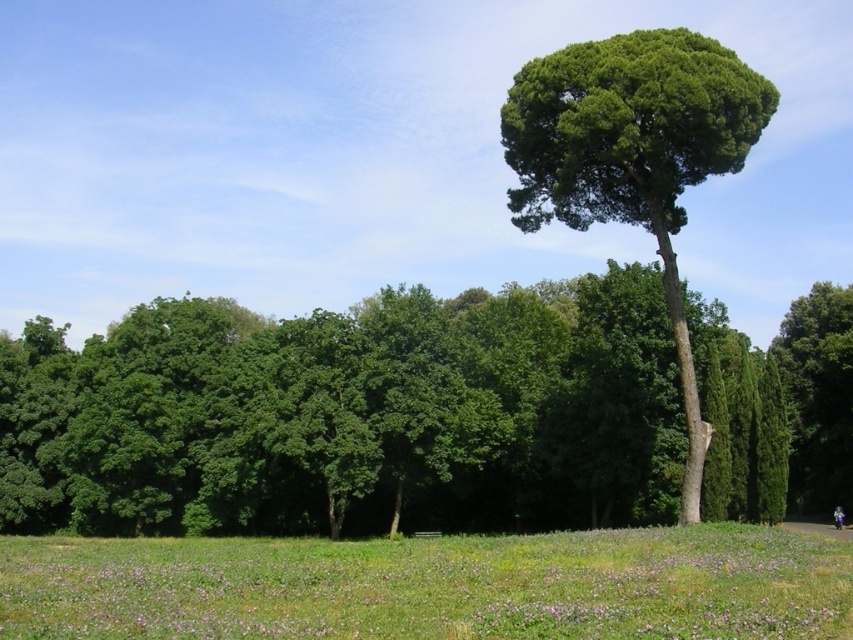
Based on the photo, is green leafy tree at right behind dark blue jeans at center?

Yes.

From the picture: Can you confirm if green leafy tree at right is positioned to the right of dark blue jeans at center?

Yes, green leafy tree at right is to the right of dark blue jeans at center.

Locate an element on the screen. Image resolution: width=853 pixels, height=640 pixels. green leafy tree at right is located at coordinates (817, 396).

This screenshot has height=640, width=853. Describe the element at coordinates (433, 586) in the screenshot. I see `green grassy field at lower center` at that location.

Does point (686, 532) lie behind point (514, 208)?

No.

Where is `green grassy field at lower center`? The image size is (853, 640). green grassy field at lower center is located at coordinates (433, 586).

Locate an element on the screen. Image resolution: width=853 pixels, height=640 pixels. green leafy tree at center is located at coordinates point(633,156).

Between green leafy tree at center and dark blue jeans at center, which one appears on the left side from the viewer's perspective?

green leafy tree at center

I want to click on green leafy tree at center, so click(x=633, y=156).